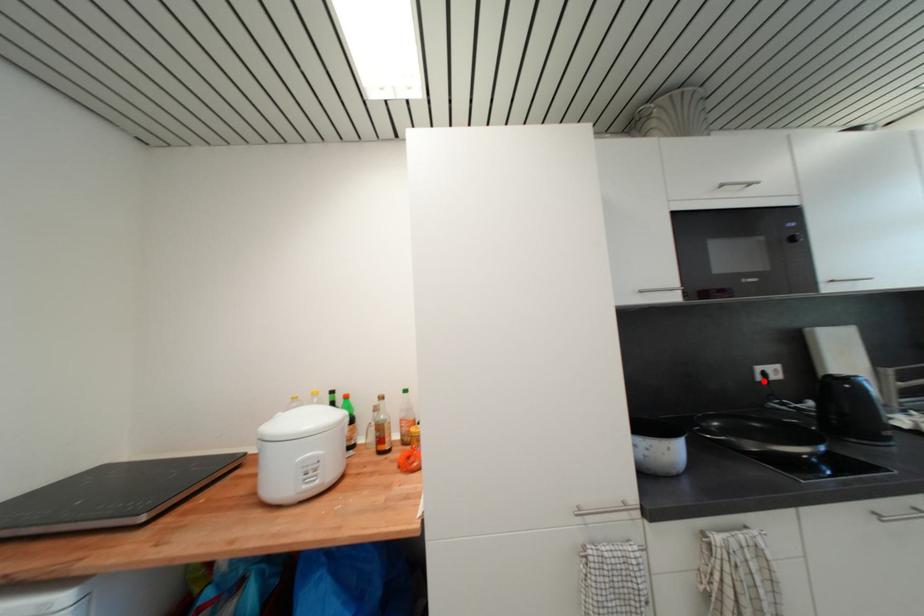
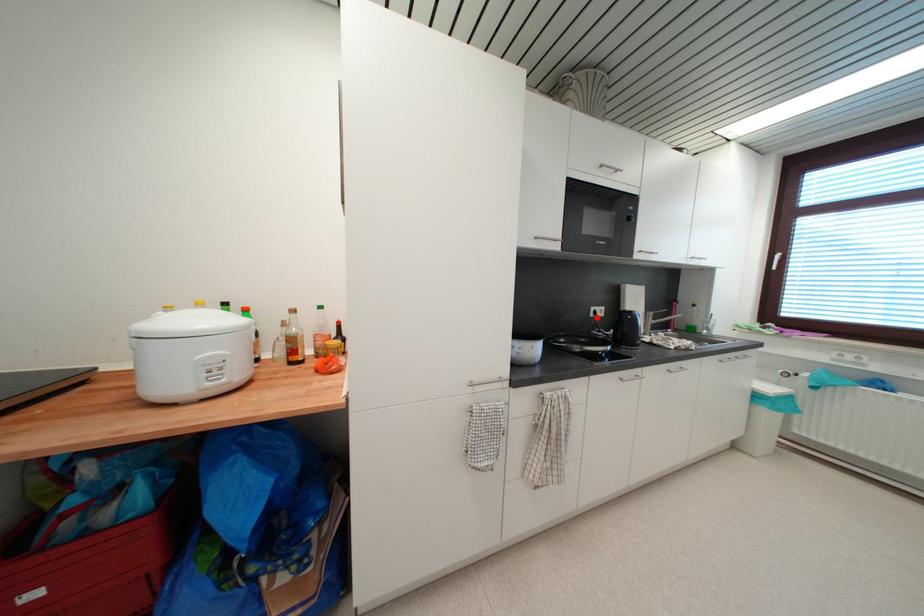
I am providing you with two images of the same scene from different viewpoints. A red point is marked on the first image and another point is marked on the second image. Is the red point in image1 aligned with the point shown in image2?

Yes